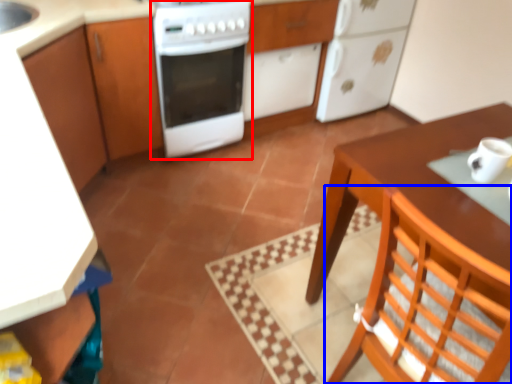
Question: Which object is further to the camera taking this photo, home appliance (highlighted by a red box) or chair (highlighted by a blue box)?

Choices:
 (A) home appliance
 (B) chair

Answer: (A)